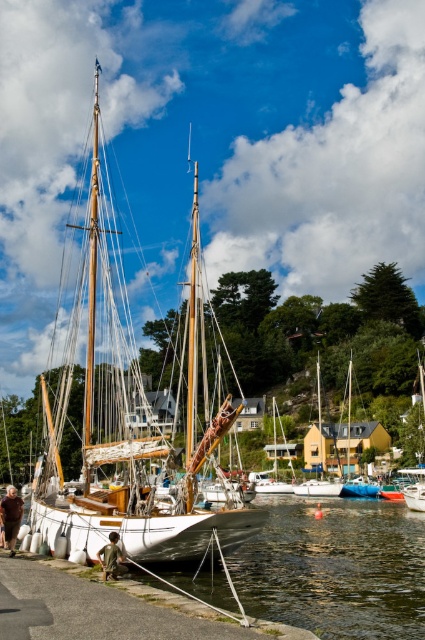
Is white polished wood sailboat at center shorter than blue rubber dinghy at center?

No.

Between point (129, 316) and point (368, 497), which one is positioned in front?

Point (368, 497) is in front.

Who is more distant from viewer, (98, 541) or (351, 493)?

The point (351, 493) is behind.

The width and height of the screenshot is (425, 640). Find the location of `white polished wood sailboat at center`. white polished wood sailboat at center is located at coordinates (125, 417).

Does point (297, 484) come farther from viewer compared to point (350, 419)?

No, (297, 484) is in front of (350, 419).

Is wooden sailboat at center below white wooden sailboat at center?

Correct, wooden sailboat at center is located below white wooden sailboat at center.

Where is `wooden sailboat at center`? Image resolution: width=425 pixels, height=640 pixels. wooden sailboat at center is located at coordinates (319, 456).

Does white polished wood sailboat at center have a lesser height compared to white wooden sailboat at center?

Incorrect, white polished wood sailboat at center's height does not fall short of white wooden sailboat at center's.

Between point (116, 502) and point (346, 451), which one is positioned in front?

Point (116, 502)

Does point (39, 512) lie in front of point (348, 449)?

Yes, point (39, 512) is closer to viewer.

What are the coordinates of `white polished wood sailboat at center` in the screenshot? It's located at (125, 417).